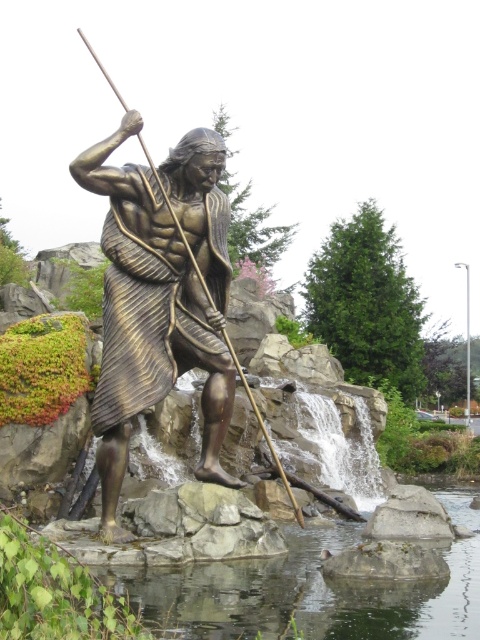
Question: Which point is closer to the camera taking this photo?

Choices:
 (A) (120, 268)
 (B) (474, 580)

Answer: (B)

Question: Does bronze statue at center appear on the left side of clear water at center?

Choices:
 (A) yes
 (B) no

Answer: (A)

Question: Which point is farther to the camera?

Choices:
 (A) clear water at center
 (B) bronze statue at center

Answer: (B)

Question: Which of the following is the closest to the observer?

Choices:
 (A) (443, 547)
 (B) (100, 148)

Answer: (B)

Question: Is bronze statue at center closer to the viewer compared to clear water at center?

Choices:
 (A) yes
 (B) no

Answer: (B)

Question: Can you confirm if bronze statue at center is smaller than clear water at center?

Choices:
 (A) yes
 (B) no

Answer: (B)